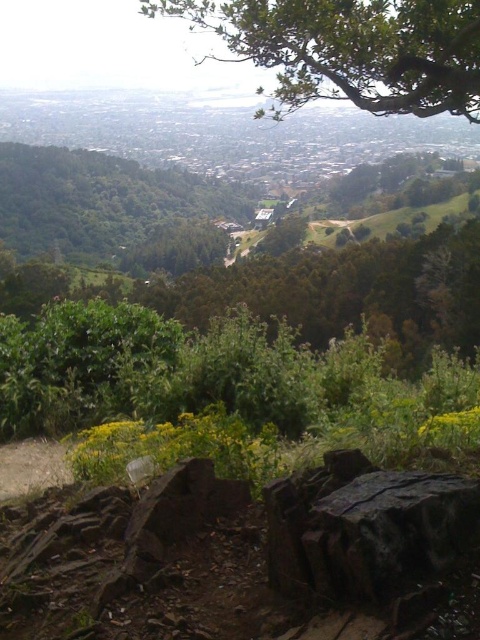
You are a hiker planning to set up a campsite between the green leafy tree at upper center and the green leafy tree at center. The recommended safe distance for tents from trees is 20 feet to prevent falling branches. Is the space between these two trees sufficient to accommodate two tents placed 10 feet apart from each other?

The distance between the green leafy tree at upper center and the green leafy tree at center is 75.28 feet. Subtracting the required 20 feet safety distance from each tree, the available space is 75.28 ft minus 40 ft equals 35.28 ft. Two tents placed 10 feet apart would need a minimum of 20 feet of space. Since 35.28 ft is greater than 20 ft, the space is sufficient.

Based on the provided scene description, where is the green leafy tree at upper center located in terms of its 2D coordinates?

The green leafy tree at upper center is located at the 2D coordinates of point (348, 49).

You are a hiker standing at the base of the green leafy tree at center and want to reach the green leafy tree at upper center. Which direction should you move to get there?

The green leafy tree at upper center is located above the green leafy tree at center, so you should move upward or towards the higher elevation to reach it.